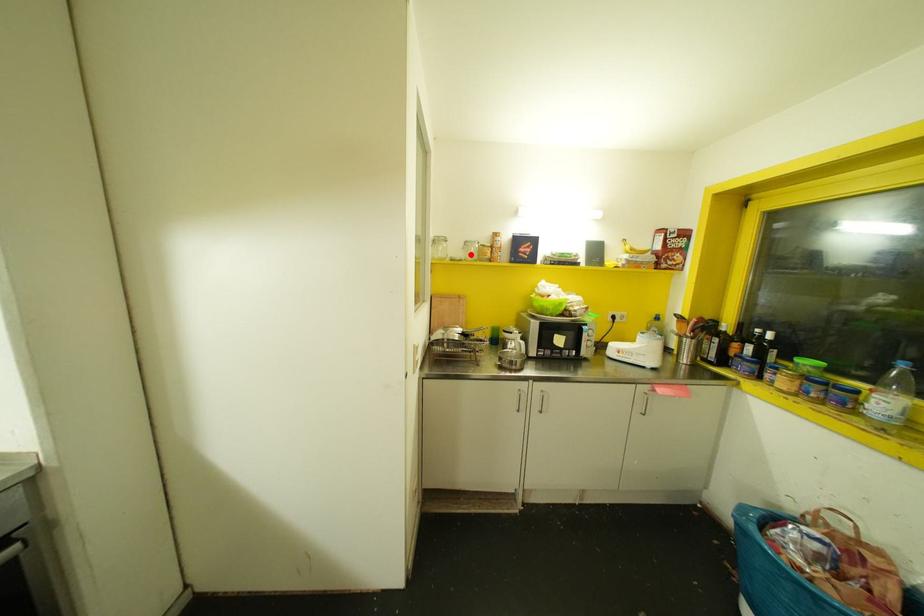
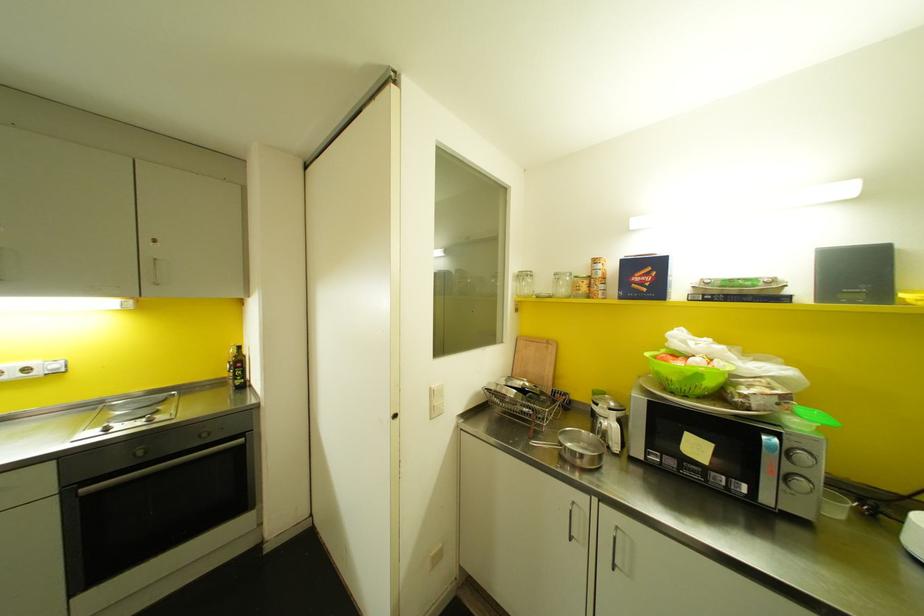
Where in the second image is the point corresponding to the highlighted location from the first image?

(562, 290)